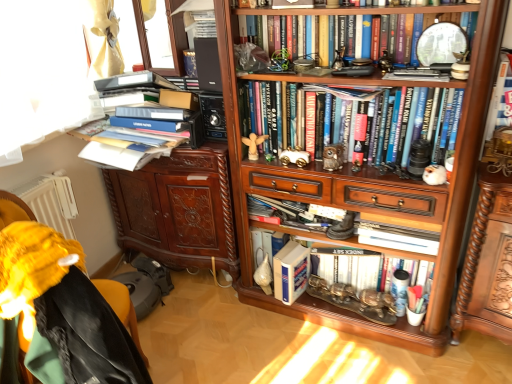
Question: Does blue hardcover book at center, which ranks as the fifth book in top-to-bottom order, come in front of wooden angel at center, the first toy viewed from the left?

Choices:
 (A) no
 (B) yes

Answer: (A)

Question: Is blue hardcover book at center, which is counted as the first book, starting from the bottom, looking in the opposite direction of wooden angel at center, which is the 3th toy in front-to-back order?

Choices:
 (A) yes
 (B) no

Answer: (B)

Question: Is blue hardcover book at center, which is counted as the first book, starting from the bottom, placed right next to wooden angel at center, the first toy viewed from the left?

Choices:
 (A) no
 (B) yes

Answer: (A)

Question: Considering the relative sizes of blue hardcover book at center, which is counted as the first book, starting from the bottom, and wooden angel at center, arranged as the fourth toy when viewed from the right, in the image provided, is blue hardcover book at center, which is counted as the first book, starting from the bottom, shorter than wooden angel at center, arranged as the fourth toy when viewed from the right,?

Choices:
 (A) yes
 (B) no

Answer: (B)

Question: Is blue hardcover book at center, which ranks as the fifth book in top-to-bottom order, smaller than wooden angel at center, placed as the 2th toy when sorted from back to front?

Choices:
 (A) no
 (B) yes

Answer: (A)

Question: Is blue hardcover book at center, which ranks as the fifth book in top-to-bottom order, at the left side of wooden angel at center, which is the 3th toy in front-to-back order?

Choices:
 (A) no
 (B) yes

Answer: (A)

Question: Could you tell me if transparent glass window at upper left is facing blue hardcover book at center, which ranks as the fifth book in top-to-bottom order?

Choices:
 (A) yes
 (B) no

Answer: (B)

Question: Considering the relative sizes of transparent glass window at upper left and blue hardcover book at center, which ranks as the fifth book in top-to-bottom order, in the image provided, is transparent glass window at upper left wider than blue hardcover book at center, which ranks as the fifth book in top-to-bottom order,?

Choices:
 (A) yes
 (B) no

Answer: (B)

Question: From a real-world perspective, does transparent glass window at upper left stand above blue hardcover book at center, which is counted as the first book, starting from the bottom?

Choices:
 (A) no
 (B) yes

Answer: (B)

Question: Could blue hardcover book at center, which ranks as the fifth book in top-to-bottom order, be considered to be inside transparent glass window at upper left?

Choices:
 (A) no
 (B) yes

Answer: (A)

Question: Is transparent glass window at upper left located outside blue hardcover book at center, which is counted as the first book, starting from the bottom?

Choices:
 (A) yes
 (B) no

Answer: (A)

Question: Is transparent glass window at upper left facing away from blue hardcover book at center, which ranks as the fifth book in top-to-bottom order?

Choices:
 (A) yes
 (B) no

Answer: (B)

Question: Is hardcover books at center, the 3th book ordered from the bottom, next to white fur figurine at center-right and touching it?

Choices:
 (A) no
 (B) yes

Answer: (A)